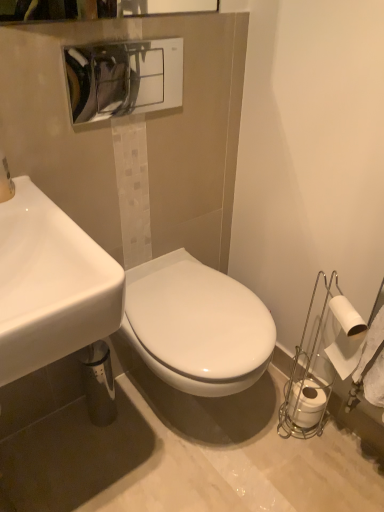
At what (x,y) coordinates should I click in order to perform the action: click on free spot below white glossy sink at left, the 2th sink viewed from the back (from a real-world perspective). Please return your answer as a coordinate pair (x, y). This screenshot has height=512, width=384. Looking at the image, I should click on 59,474.